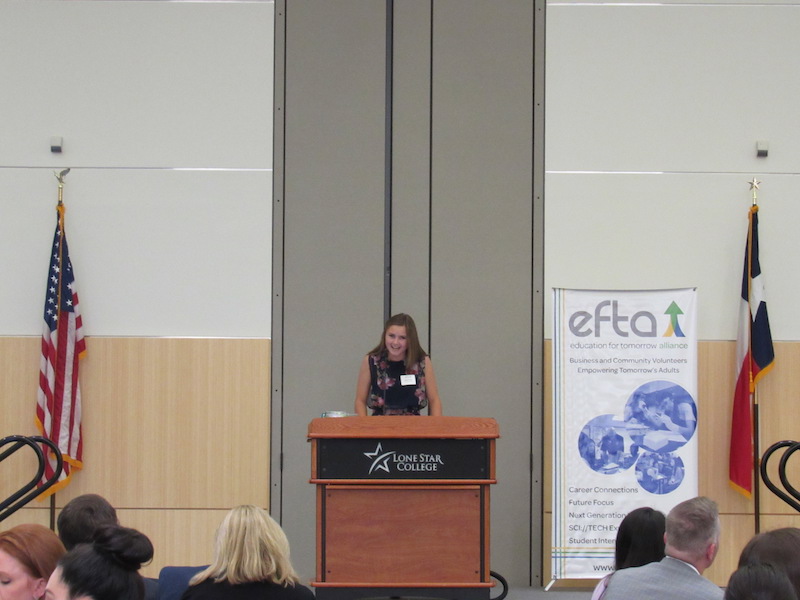
Identify the location of white wall. (657, 128).